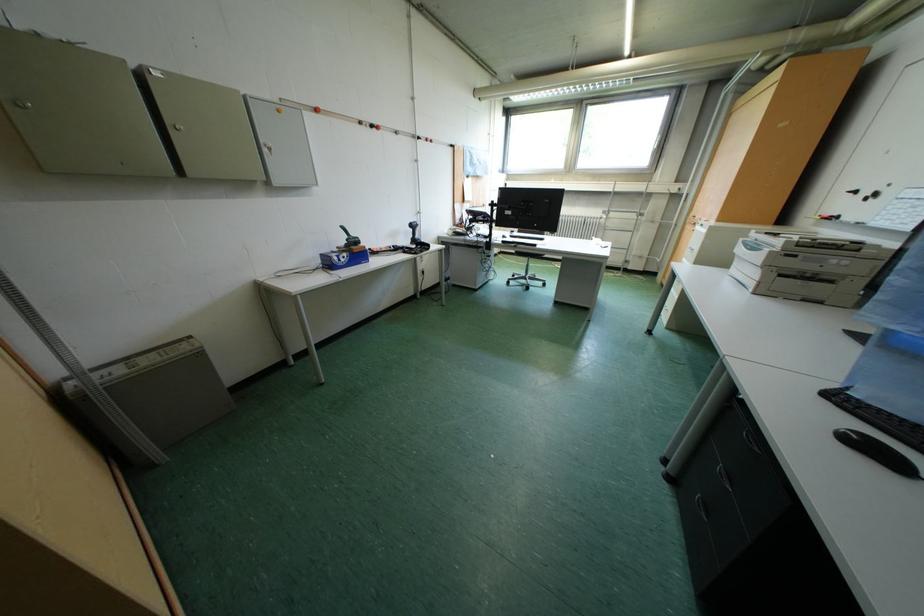
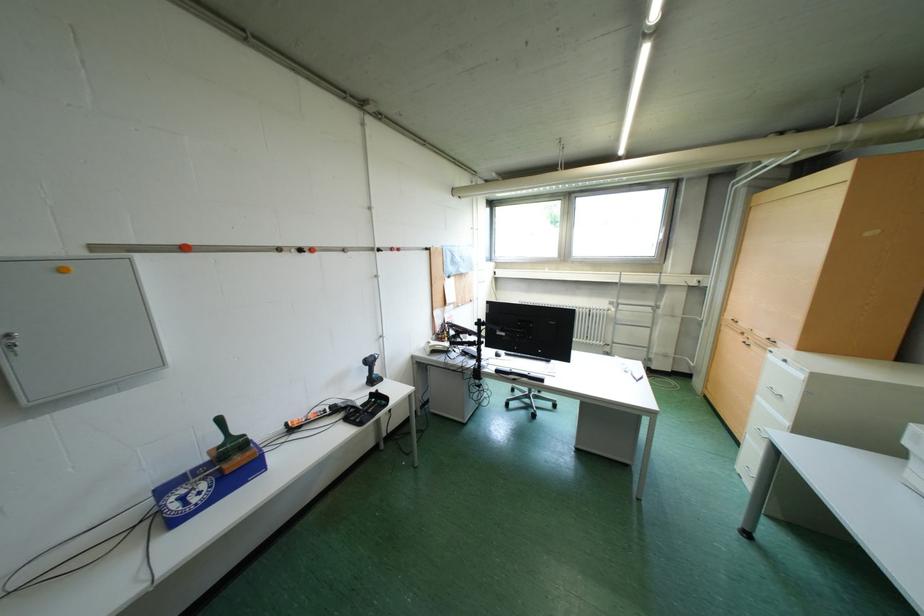
Question: Which direction would the cameraman need to move to produce the second image? Reply with the corresponding letter.

Choices:
 (A) Left
 (B) Right
 (C) Forward
 (D) Backward

Answer: (C)